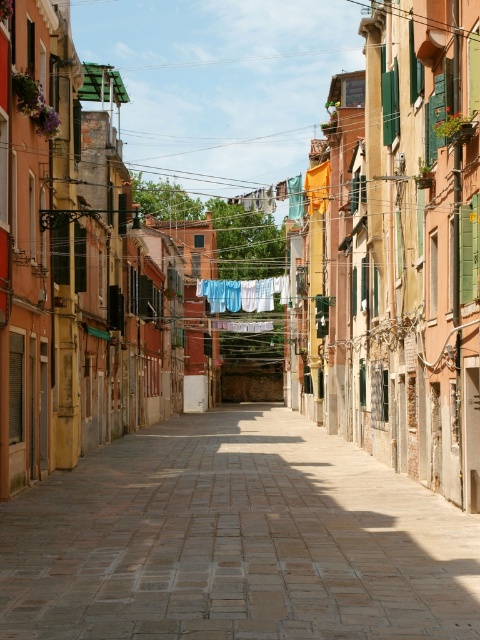
Is brick paved alley at center shorter than blue fabric at center?

Yes, brick paved alley at center is shorter than blue fabric at center.

Is point (345, 548) in front of point (259, 300)?

Yes, it is.

Is point (227, 563) closer to camera compared to point (240, 301)?

Yes, point (227, 563) is in front of point (240, 301).

You are a GUI agent. You are given a task and a screenshot of the screen. Output one action in this format:
    pyautogui.click(x=<x>, y=<y>)
    Task: Click on the brick paved alley at center
    Image resolution: width=480 pixels, height=640 pixels.
    Given the screenshot: What is the action you would take?
    pyautogui.click(x=236, y=540)